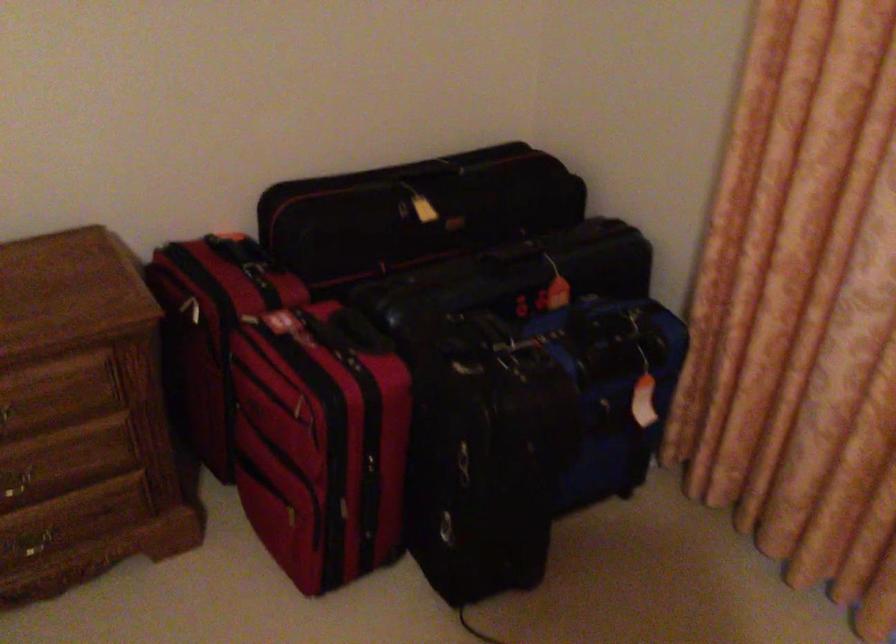
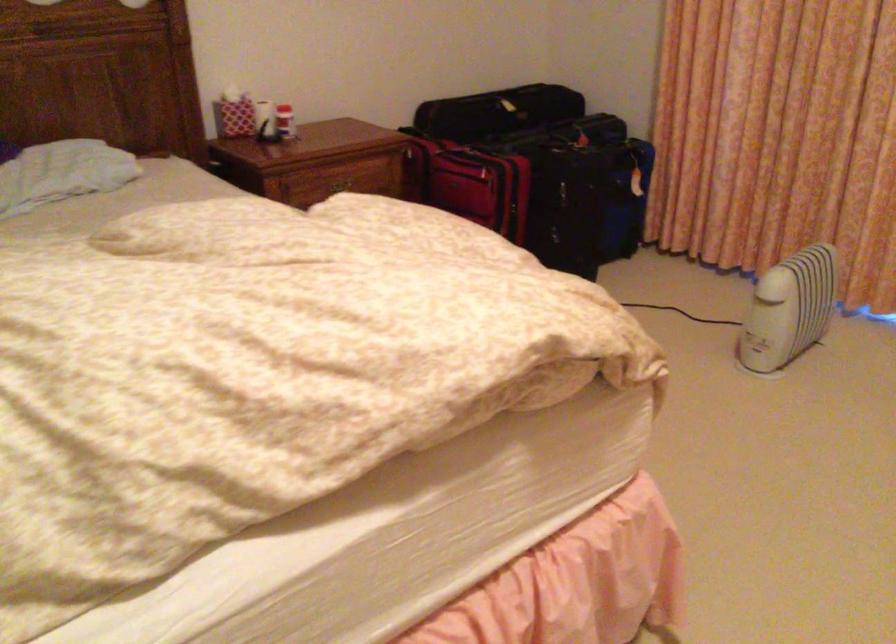
Where in the second image is the point corresponding to point (655, 462) from the first image?

(649, 223)